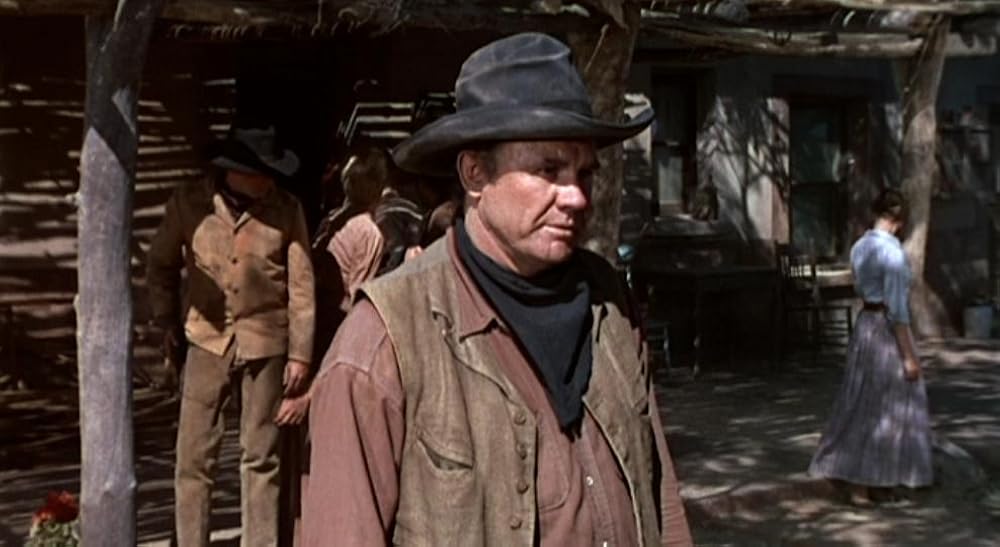
Locate an element on the screen. chair is located at coordinates (814, 308).